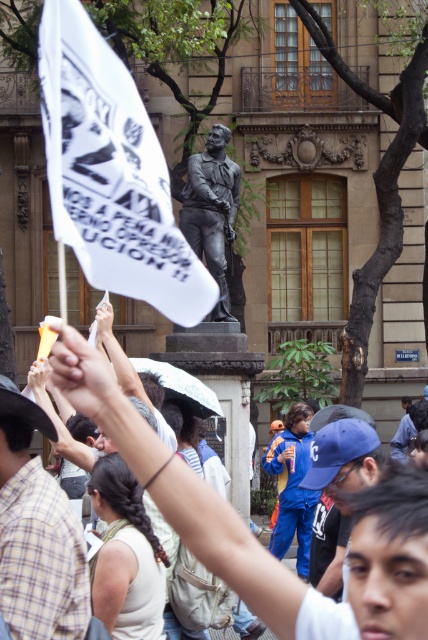
You are a photographer standing at the center of the gathering. You notice two points marked in the image. The first point is at coordinate point[341,468] and the second is at point[219,237]. From your position, which point is closer to you?

Point[341,468] is in front of point[219,237], so it is closer to you.

You are a photographer standing at the edge of the crowd. You want to capture a photo that includes both the white paper flag at upper left and the bronze statue at center without any obstructions. Given their distance apart, is this possible with a standard camera lens? Explain your reasoning.

The white paper flag at upper left and bronze statue at center are 22.08 meters apart. A standard camera lens has a maximum focal length of around 50mm, which can capture objects up to approximately 20 meters apart in the same frame. Since the distance between them is 22.08 meters, which exceeds this limit, it would be challenging to fit both into a single photo without moving closer or using a wider lens.

What is the exact 2D coordinate of the white paper flag at upper left in the image?

The exact 2D coordinate of the white paper flag at upper left is at point (x=112, y=172).